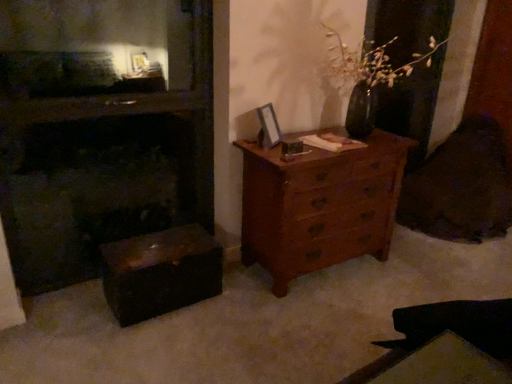
The width and height of the screenshot is (512, 384). What do you see at coordinates (102, 152) in the screenshot? I see `dark wood fireplace at left` at bounding box center [102, 152].

In order to face dark wood fireplace at left, should I rotate leftwards or rightwards?

To align with it, rotate left about 17.923°.

Measure the distance between point (142, 242) and camera.

The distance of point (142, 242) from camera is 2.37 meters.

Locate an element on the screen. The width and height of the screenshot is (512, 384). dark wood fireplace at left is located at coordinates (102, 152).

From a real-world perspective, which is physically below, dark wood fireplace at left or shiny dark wood trunk at lower left?

shiny dark wood trunk at lower left, from a real-world perspective.

In terms of width, does dark wood fireplace at left look wider or thinner when compared to shiny dark wood trunk at lower left?

dark wood fireplace at left is thinner than shiny dark wood trunk at lower left.

Does point (203, 151) come closer to viewer compared to point (123, 278)?

No, (203, 151) is behind (123, 278).

Between shiny dark wood trunk at lower left and wooden chest of drawers at right, which one has less height?

shiny dark wood trunk at lower left is shorter.

Considering the points (187, 264) and (308, 250), which point is behind, point (187, 264) or point (308, 250)?

The point (308, 250) is more distant.

Can you confirm if shiny dark wood trunk at lower left is bigger than wooden chest of drawers at right?

Incorrect, shiny dark wood trunk at lower left is not larger than wooden chest of drawers at right.

Can you tell me how much shiny dark wood trunk at lower left and wooden chest of drawers at right differ in facing direction?

0.917 degrees.

Does point (271, 108) come farther from viewer compared to point (152, 278)?

That is True.

From their relative heights in the image, would you say wooden picture frame at upper center is taller or shorter than shiny dark wood trunk at lower left?

Clearly, wooden picture frame at upper center is shorter compared to shiny dark wood trunk at lower left.

Is wooden picture frame at upper center aimed at shiny dark wood trunk at lower left?

No, wooden picture frame at upper center is not aimed at shiny dark wood trunk at lower left.

Where is `picture frame that appears behind the shiny dark wood trunk at lower left`? The height and width of the screenshot is (384, 512). picture frame that appears behind the shiny dark wood trunk at lower left is located at coordinates (268, 126).

Which object is wider, dark wood fireplace at left or wooden picture frame at upper center?

dark wood fireplace at left is wider.

Where is `picture frame above the dark wood fireplace at left (from the image's perspective)`? picture frame above the dark wood fireplace at left (from the image's perspective) is located at coordinates (268, 126).

From the picture: From a real-world perspective, is dark wood fireplace at left on wooden picture frame at upper center?

No, from a real-world perspective, dark wood fireplace at left is not above wooden picture frame at upper center.

Are wooden chest of drawers at right and shiny dark wood trunk at lower left making contact?

No, wooden chest of drawers at right is not with shiny dark wood trunk at lower left.

Which object is positioned more to the right, wooden chest of drawers at right or shiny dark wood trunk at lower left?

Positioned to the right is wooden chest of drawers at right.

Image resolution: width=512 pixels, height=384 pixels. I want to click on vanity on the left of wooden chest of drawers at right, so click(x=160, y=272).

From a real-world perspective, which object stands above the other?

From a 3D spatial view, wooden chest of drawers at right is above.

Can you confirm if wooden picture frame at upper center is taller than wooden chest of drawers at right?

No, wooden picture frame at upper center is not taller than wooden chest of drawers at right.

Based on their sizes in the image, would you say wooden picture frame at upper center is bigger or smaller than wooden chest of drawers at right?

Considering their sizes, wooden picture frame at upper center takes up less space than wooden chest of drawers at right.

Is wooden picture frame at upper center touching wooden chest of drawers at right?

There is a gap between wooden picture frame at upper center and wooden chest of drawers at right.

Where is `picture frame lying behind the wooden chest of drawers at right`? This screenshot has width=512, height=384. picture frame lying behind the wooden chest of drawers at right is located at coordinates (268, 126).

Is wooden chest of drawers at right next to wooden picture frame at upper center?

No, wooden chest of drawers at right is not with wooden picture frame at upper center.

You are a GUI agent. You are given a task and a screenshot of the screen. Output one action in this format:
    pyautogui.click(x=<x>, y=<y>)
    Task: Click on the picture frame that appears above the wooden chest of drawers at right (from a real-world perspective)
    
    Given the screenshot: What is the action you would take?
    pyautogui.click(x=268, y=126)

Which point is more forward, (313, 169) or (267, 121)?

The point (313, 169) is closer.

From a real-world perspective, is wooden chest of drawers at right positioned above or below wooden picture frame at upper center?

Clearly, from a real-world perspective, wooden chest of drawers at right is below wooden picture frame at upper center.

Find the location of `vanity located underneath the dark wood fireplace at left (from a real-world perspective)`. vanity located underneath the dark wood fireplace at left (from a real-world perspective) is located at coordinates pyautogui.click(x=160, y=272).

Identify the location of the chest of drawers behind the shiny dark wood trunk at lower left. Image resolution: width=512 pixels, height=384 pixels. (319, 205).

From the image, which object appears to be farther from dark wood fireplace at left, shiny dark wood trunk at lower left or wooden chest of drawers at right?

wooden chest of drawers at right is further to dark wood fireplace at left.

From the image, which object appears to be nearer to dark wood fireplace at left, wooden chest of drawers at right or shiny dark wood trunk at lower left?

Based on the image, shiny dark wood trunk at lower left appears to be nearer to dark wood fireplace at left.

Which object lies further to the anchor point wooden picture frame at upper center, dark wood fireplace at left or wooden chest of drawers at right?

The object further to wooden picture frame at upper center is dark wood fireplace at left.

Which object lies nearer to the anchor point shiny dark wood trunk at lower left, wooden picture frame at upper center or dark wood fireplace at left?

Based on the image, dark wood fireplace at left appears to be nearer to shiny dark wood trunk at lower left.

Looking at this image, which object lies further to the anchor point shiny dark wood trunk at lower left, wooden picture frame at upper center or wooden chest of drawers at right?

Among the two, wooden picture frame at upper center is located further to shiny dark wood trunk at lower left.

Looking at the image, which one is located closer to wooden picture frame at upper center, wooden chest of drawers at right or shiny dark wood trunk at lower left?

wooden chest of drawers at right lies closer to wooden picture frame at upper center than the other object.

Estimate the real-world distances between objects in this image. Which object is closer to wooden picture frame at upper center, shiny dark wood trunk at lower left or wooden chest of drawers at right?

wooden chest of drawers at right is positioned closer to the anchor wooden picture frame at upper center.

Based on the photo, which object lies nearer to the anchor point wooden chest of drawers at right, dark wood fireplace at left or shiny dark wood trunk at lower left?

shiny dark wood trunk at lower left lies closer to wooden chest of drawers at right than the other object.

This screenshot has width=512, height=384. I want to click on picture frame located between shiny dark wood trunk at lower left and wooden chest of drawers at right in the left-right direction, so click(268, 126).

At what (x,y) coordinates should I click in order to perform the action: click on picture frame between dark wood fireplace at left and wooden chest of drawers at right in the horizontal direction. Please return your answer as a coordinate pair (x, y). Looking at the image, I should click on click(268, 126).

The width and height of the screenshot is (512, 384). Identify the location of vanity situated between dark wood fireplace at left and wooden chest of drawers at right from left to right. (160, 272).

The width and height of the screenshot is (512, 384). Identify the location of fireplace that lies between wooden picture frame at upper center and shiny dark wood trunk at lower left from top to bottom. (102, 152).